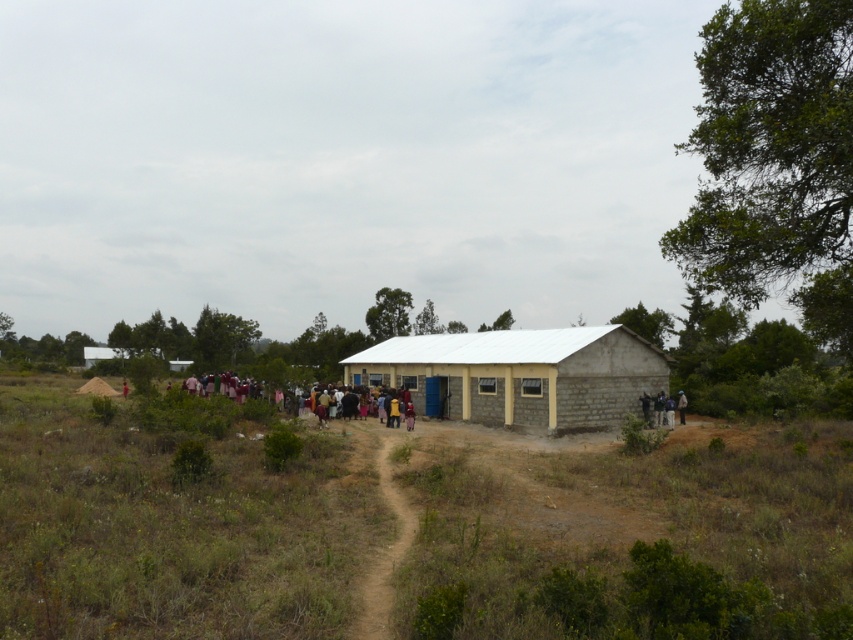
Question: Can you confirm if brown soil at center is bigger than white corrugated metal hut at center?

Choices:
 (A) no
 (B) yes

Answer: (B)

Question: Is brown dirt track at center bigger than multicolored fabric people at center?

Choices:
 (A) yes
 (B) no

Answer: (B)

Question: Which object is closer to the camera taking this photo?

Choices:
 (A) multicolored fabric people at center
 (B) white corrugated metal hut at center

Answer: (A)

Question: Which object appears farthest from the camera in this image?

Choices:
 (A) multicolored fabric people at center
 (B) brown soil at center
 (C) white corrugated metal hut at center

Answer: (C)

Question: Which object is farther from the camera taking this photo?

Choices:
 (A) brown dirt track at center
 (B) white corrugated metal hut at center
 (C) brown soil at center
 (D) multicolored fabric people at center

Answer: (B)

Question: Does white corrugated metal hut at center have a lesser width compared to multicolored fabric people at center?

Choices:
 (A) yes
 (B) no

Answer: (B)